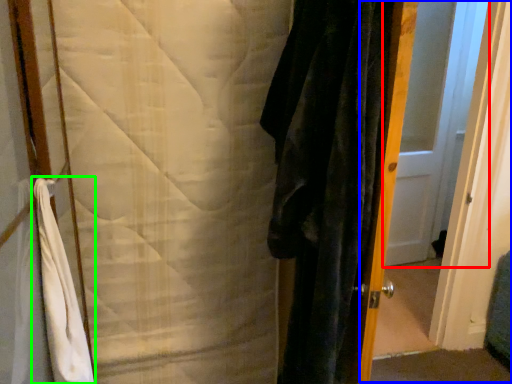
Question: Which object is positioned farthest from door (highlighted by a red box)? Select from screen door (highlighted by a blue box) and bath towel (highlighted by a green box).

Choices:
 (A) screen door
 (B) bath towel

Answer: (B)